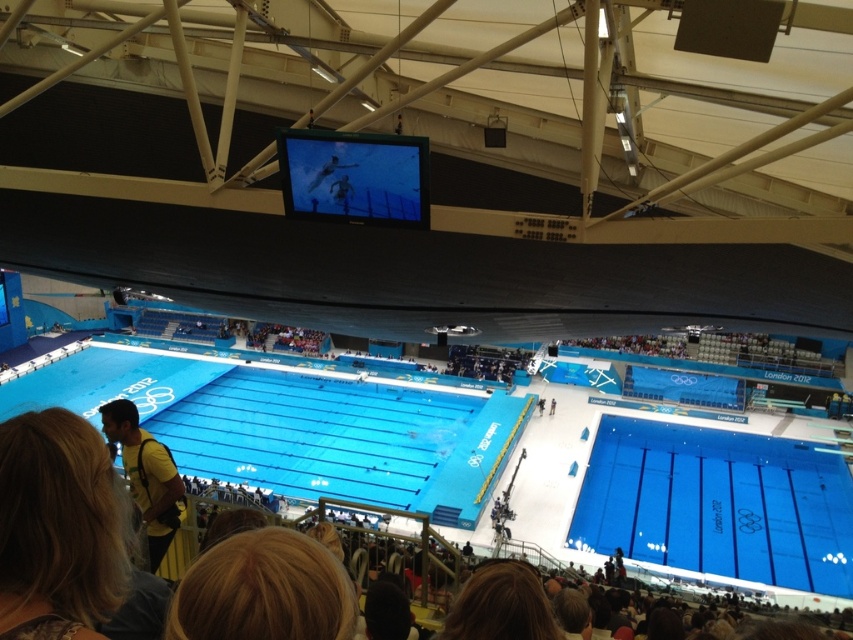
Question: Can you confirm if brown hair at lower center is bigger than yellow fabric backpack at lower left?

Choices:
 (A) no
 (B) yes

Answer: (B)

Question: Which point is closer to the camera?

Choices:
 (A) yellow fabric backpack at lower left
 (B) brown hair at lower center
 (C) blue smooth water at center
 (D) blue smooth pool at lower right

Answer: (A)

Question: Does blue smooth pool at lower right have a greater width compared to brown hair at lower center?

Choices:
 (A) yes
 (B) no

Answer: (B)

Question: Does blue smooth pool at lower right have a larger size compared to yellow fabric backpack at lower left?

Choices:
 (A) yes
 (B) no

Answer: (A)

Question: Which object is closer to the camera taking this photo?

Choices:
 (A) blue smooth pool at lower right
 (B) brown hair at lower center
 (C) blue smooth water at center
 (D) yellow fabric backpack at lower left

Answer: (D)

Question: Among these points, which one is nearest to the camera?

Choices:
 (A) (653, 490)
 (B) (842, 582)

Answer: (B)